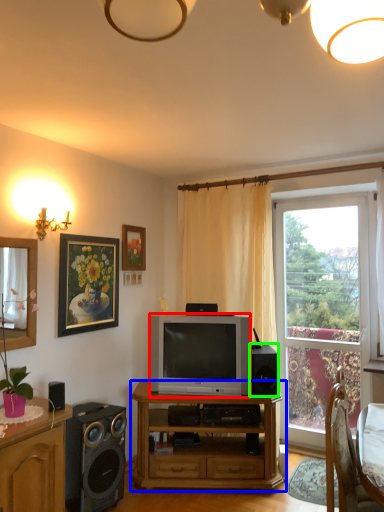
Question: Considering the real-world distances, which object is closest to television (highlighted by a red box)? desk (highlighted by a blue box) or speaker (highlighted by a green box).

Choices:
 (A) desk
 (B) speaker

Answer: (B)